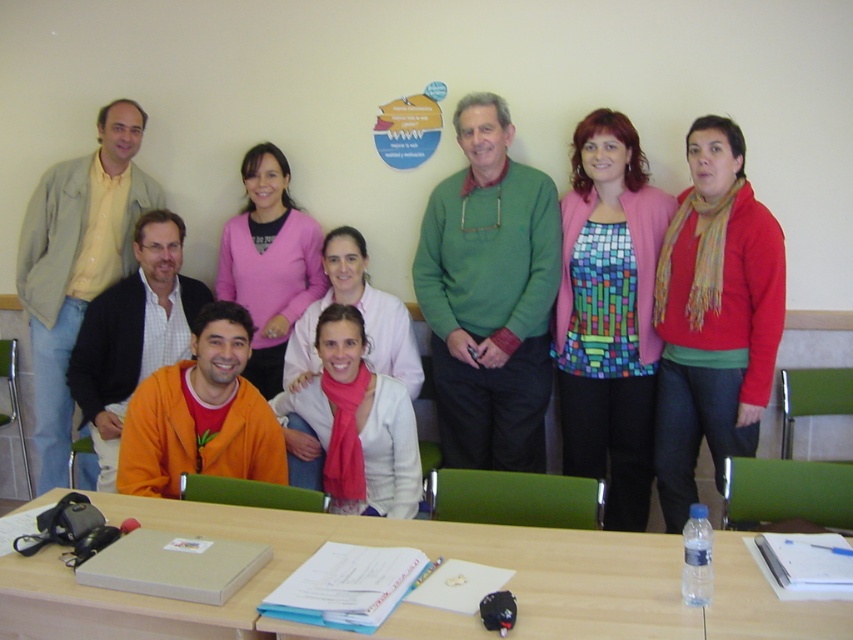
The width and height of the screenshot is (853, 640). What do you see at coordinates (76, 262) in the screenshot? I see `matte yellow shirt at upper left` at bounding box center [76, 262].

Does matte yellow shirt at upper left appear on the left side of pink matte sweater at center?

Yes, matte yellow shirt at upper left is to the left of pink matte sweater at center.

Is point (48, 467) less distant than point (242, 301)?

No, (48, 467) is further to viewer.

The image size is (853, 640). Find the location of `matte yellow shirt at upper left`. matte yellow shirt at upper left is located at coordinates (76, 262).

Is matte yellow shirt at upper left thinner than orange matte jacket at lower left?

In fact, matte yellow shirt at upper left might be wider than orange matte jacket at lower left.

Does matte yellow shirt at upper left appear on the left side of orange matte jacket at lower left?

Yes, matte yellow shirt at upper left is to the left of orange matte jacket at lower left.

Where is `matte yellow shirt at upper left`? matte yellow shirt at upper left is located at coordinates (76, 262).

I want to click on matte yellow shirt at upper left, so click(76, 262).

Can you confirm if green sweater at center is bigger than pink matte sweater at center?

Indeed, green sweater at center has a larger size compared to pink matte sweater at center.

Can you confirm if green sweater at center is shorter than pink matte sweater at center?

No, green sweater at center is not shorter than pink matte sweater at center.

What are the coordinates of `green sweater at center` in the screenshot? It's located at (489, 296).

Where is `green sweater at center`? This screenshot has width=853, height=640. green sweater at center is located at coordinates (489, 296).